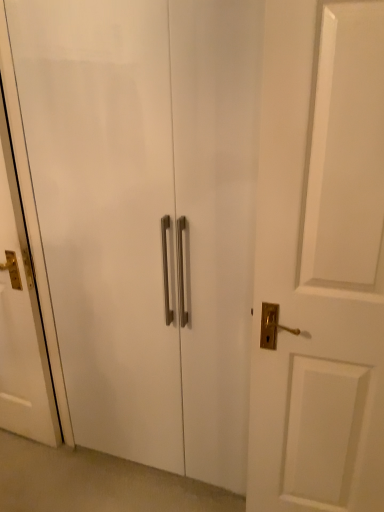
Identify the location of white glossy cabinet at center. The image size is (384, 512). (147, 218).

The width and height of the screenshot is (384, 512). Describe the element at coordinates (147, 218) in the screenshot. I see `white glossy cabinet at center` at that location.

Describe the element at coordinates (22, 315) in the screenshot. I see `white glossy door at left` at that location.

Find the location of `white glossy door at left`. white glossy door at left is located at coordinates (22, 315).

Image resolution: width=384 pixels, height=512 pixels. I want to click on white glossy cabinet at center, so click(147, 218).

In the scene shown: Which object is positioned more to the left, white glossy door at left or white glossy cabinet at center?

Positioned to the left is white glossy door at left.

Is white glossy door at left in front of or behind white glossy cabinet at center in the image?

white glossy door at left is behind white glossy cabinet at center.

Which is nearer, (1,335) or (144,216)?

Point (1,335) is positioned farther from the camera compared to point (144,216).

Looking at this image, from the image's perspective, is white glossy door at left positioned above or below white glossy cabinet at center?

white glossy door at left is situated higher than white glossy cabinet at center in the image.

From a real-world perspective, between white glossy door at left and white glossy cabinet at center, who is vertically higher?

In real-world perspective, white glossy cabinet at center is above.

Can you confirm if white glossy door at left is wider than white glossy cabinet at center?

Correct, the width of white glossy door at left exceeds that of white glossy cabinet at center.

Which of these two, white glossy door at left or white glossy cabinet at center, stands taller?

Standing taller between the two is white glossy cabinet at center.

Considering the relative sizes of white glossy door at left and white glossy cabinet at center in the image provided, is white glossy door at left smaller than white glossy cabinet at center?

Correct, white glossy door at left occupies less space than white glossy cabinet at center.

Would you say white glossy door at left is outside white glossy cabinet at center?

Yes, white glossy door at left is located beyond the bounds of white glossy cabinet at center.

Are white glossy door at left and white glossy cabinet at center far apart?

No, white glossy door at left is in close proximity to white glossy cabinet at center.

Is white glossy door at left oriented towards white glossy cabinet at center?

No.

How different are the orientations of white glossy door at left and white glossy cabinet at center in degrees?

They differ by 1.11 degrees in their facing directions.

How much distance is there between white glossy door at left and white glossy cabinet at center?

white glossy door at left is 15.47 inches away from white glossy cabinet at center.

The height and width of the screenshot is (512, 384). What are the coordinates of `screen door above the white glossy cabinet at center (from the image's perspective)` in the screenshot? It's located at (22, 315).

Is white glossy cabinet at center to the left of white glossy door at left from the viewer's perspective?

No.

Is white glossy cabinet at center in front of or behind white glossy door at left in the image?

white glossy cabinet at center is in front of white glossy door at left.

Does point (239, 161) appear closer or farther from the camera than point (26, 382)?

Point (239, 161) is positioned closer to the camera compared to point (26, 382).

From the image's perspective, is white glossy cabinet at center located above or below white glossy door at left?

Clearly, from the image's perspective, white glossy cabinet at center is below white glossy door at left.

From a real-world perspective, between white glossy cabinet at center and white glossy door at left, who is vertically lower?

From a 3D spatial view, white glossy door at left is below.

Considering the sizes of objects white glossy cabinet at center and white glossy door at left in the image provided, who is wider, white glossy cabinet at center or white glossy door at left?

Wider between the two is white glossy door at left.

Who is shorter, white glossy cabinet at center or white glossy door at left?

Standing shorter between the two is white glossy door at left.

Can you confirm if white glossy cabinet at center is smaller than white glossy door at left?

No.

Is white glossy cabinet at center inside or outside of white glossy door at left?

white glossy cabinet at center is spatially situated outside white glossy door at left.

Is white glossy cabinet at center not near white glossy door at left?

No.

Consider the image. Could you tell me if white glossy cabinet at center is turned towards white glossy door at left?

No, white glossy cabinet at center is not facing towards white glossy door at left.

How different are the orientations of white glossy cabinet at center and white glossy door at left in degrees?

white glossy cabinet at center and white glossy door at left are facing 1.11 degrees away from each other.

How distant is white glossy cabinet at center from white glossy door at left?

A distance of 15.47 inches exists between white glossy cabinet at center and white glossy door at left.

This screenshot has width=384, height=512. In order to click on screen door on the left of white glossy cabinet at center in this screenshot , I will do `click(22, 315)`.

Locate an element on the screen. The height and width of the screenshot is (512, 384). screen door behind the white glossy cabinet at center is located at coordinates (22, 315).

Locate an element on the screen. screen door above the white glossy cabinet at center (from the image's perspective) is located at coordinates pyautogui.click(x=22, y=315).